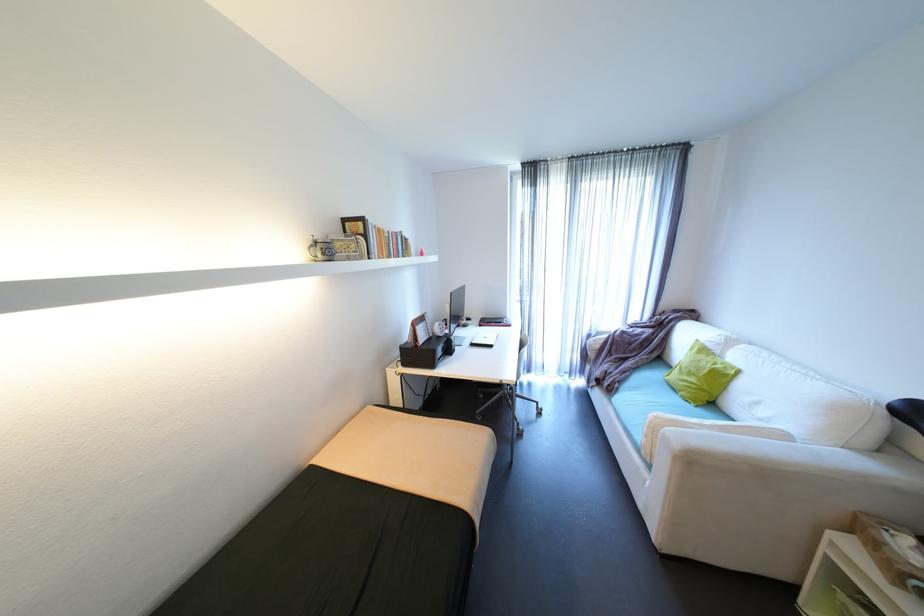
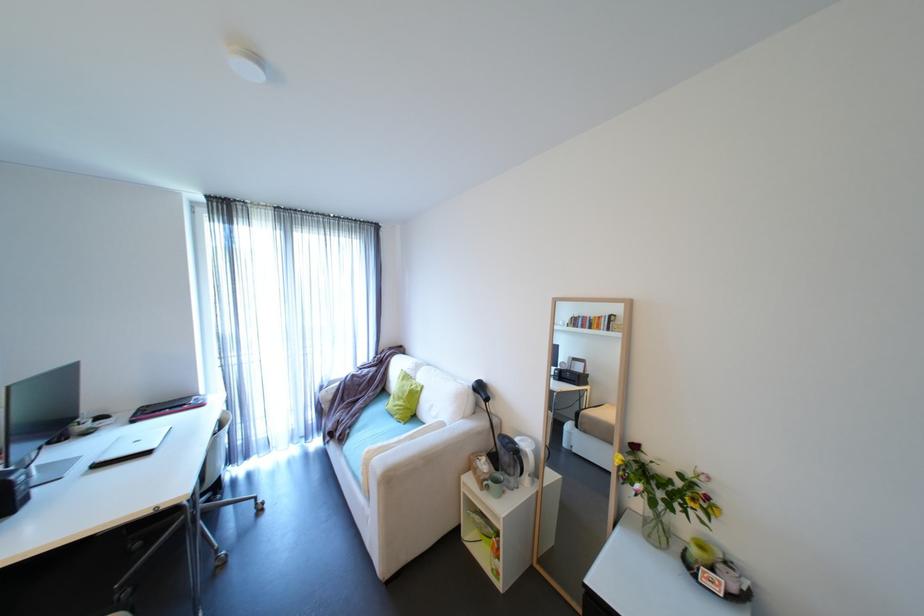
Question: I am providing you with two images of the same scene from different viewpoints. Please identify which objects are invisible in image2.

Choices:
 (A) white laptop
 (B) green mug
 (C) white electric kettle
 (D) none of these

Answer: (D)